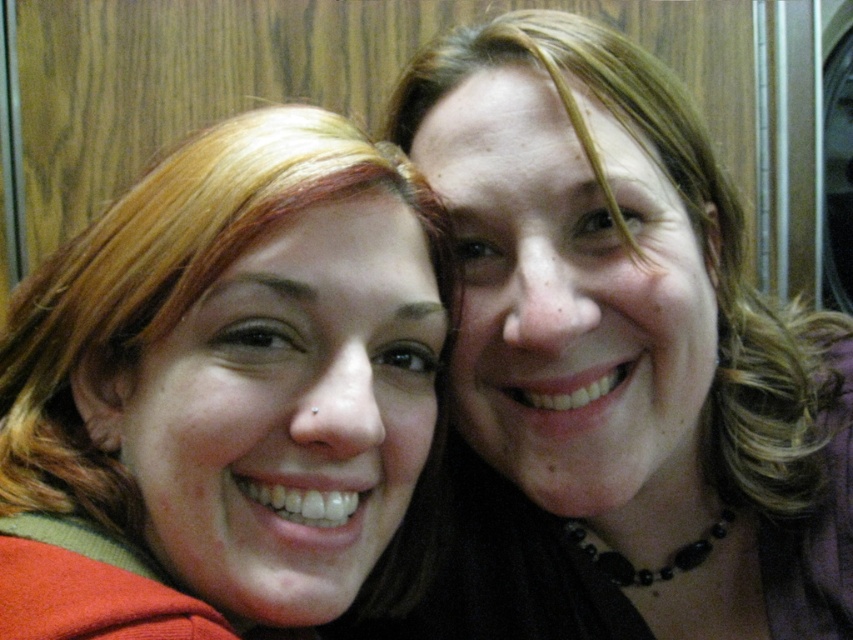
Question: Considering the relative positions of smooth black necklace at upper right and matte red hair at left in the image provided, where is smooth black necklace at upper right located with respect to matte red hair at left?

Choices:
 (A) below
 (B) above

Answer: (B)

Question: Is smooth black necklace at upper right to the right of matte red hair at left from the viewer's perspective?

Choices:
 (A) yes
 (B) no

Answer: (A)

Question: Which object is closer to the camera taking this photo?

Choices:
 (A) smooth black necklace at upper right
 (B) matte red hair at left

Answer: (B)

Question: Which point is closer to the camera taking this photo?

Choices:
 (A) (372, 508)
 (B) (532, 77)

Answer: (A)

Question: Does smooth black necklace at upper right have a lesser width compared to matte red hair at left?

Choices:
 (A) no
 (B) yes

Answer: (A)